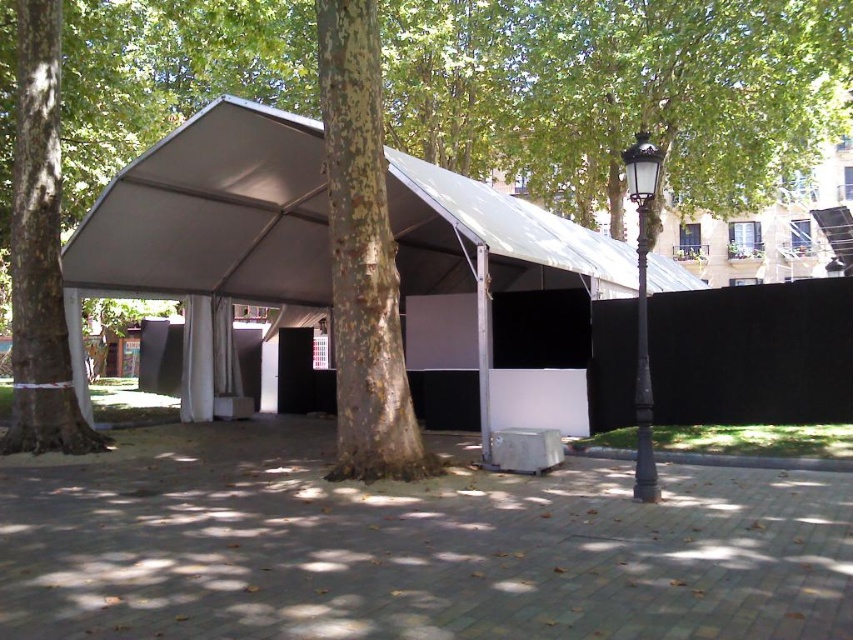
Between white fabric tent at center and green leafy tree at center, which one appears on the right side from the viewer's perspective?

From the viewer's perspective, white fabric tent at center appears more on the right side.

Who is more forward, (183, 253) or (47, 381)?

Point (47, 381) is in front.

Describe the element at coordinates (213, 212) in the screenshot. I see `white fabric tent at center` at that location.

This screenshot has height=640, width=853. What are the coordinates of `white fabric tent at center` in the screenshot? It's located at (213, 212).